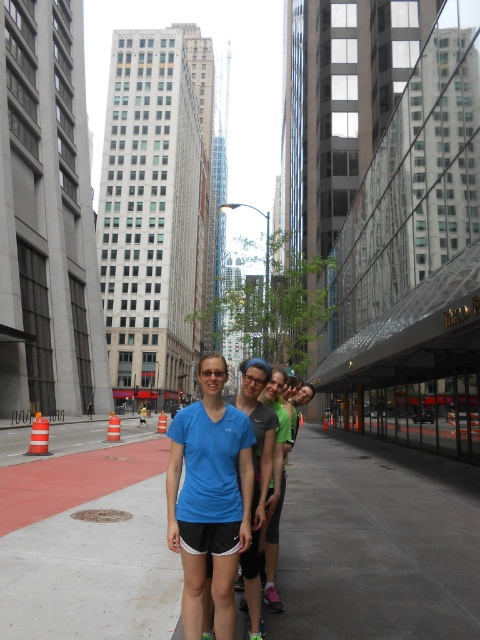
Is gray concrete pavement at center to the right of blue fabric shorts at center from the viewer's perspective?

Indeed, gray concrete pavement at center is positioned on the right side of blue fabric shorts at center.

Is gray concrete pavement at center shorter than blue fabric shorts at center?

No, gray concrete pavement at center is not shorter than blue fabric shorts at center.

Does point (71, 573) come closer to viewer compared to point (170, 426)?

No.

This screenshot has width=480, height=640. What are the coordinates of `gray concrete pavement at center` in the screenshot? It's located at (376, 544).